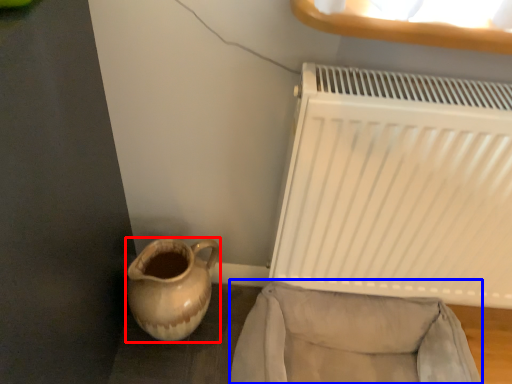
Question: Which point is closer to the camera, jug (highlighted by a red box) or armchair (highlighted by a blue box)?

Choices:
 (A) jug
 (B) armchair

Answer: (B)